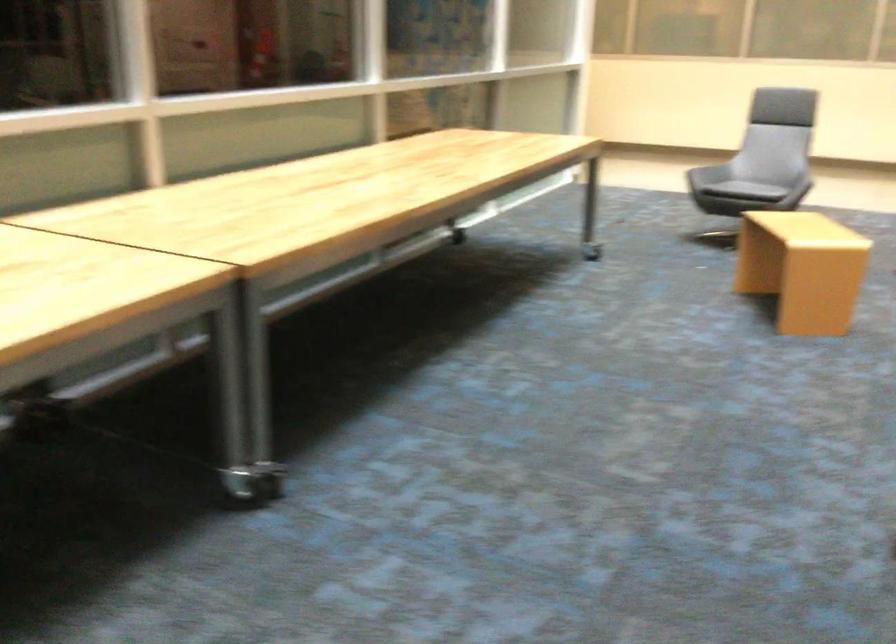
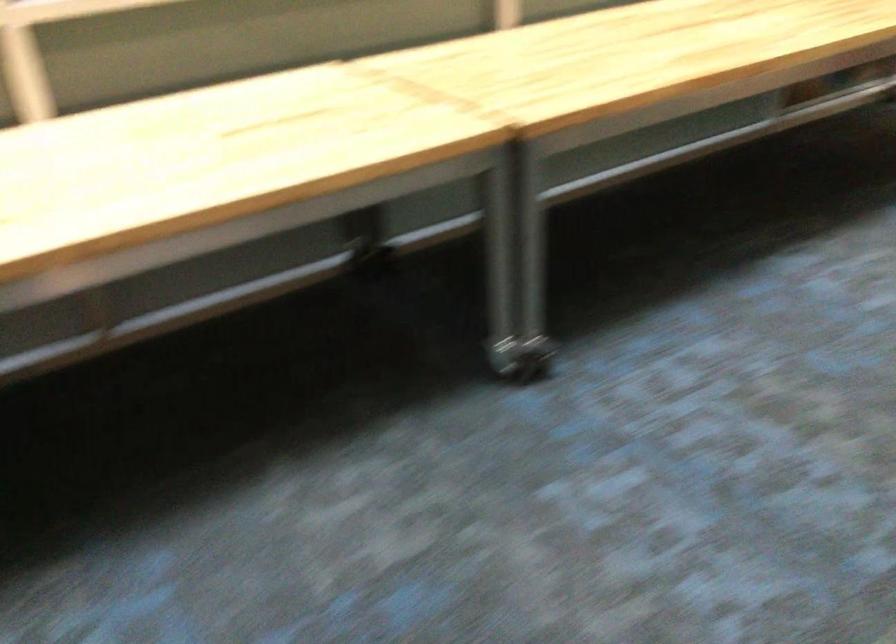
Question: Based on the continuous images, in which direction is the camera rotating? Reply with the corresponding letter.

Choices:
 (A) Left
 (B) Right
 (C) Up
 (D) Down

Answer: (A)